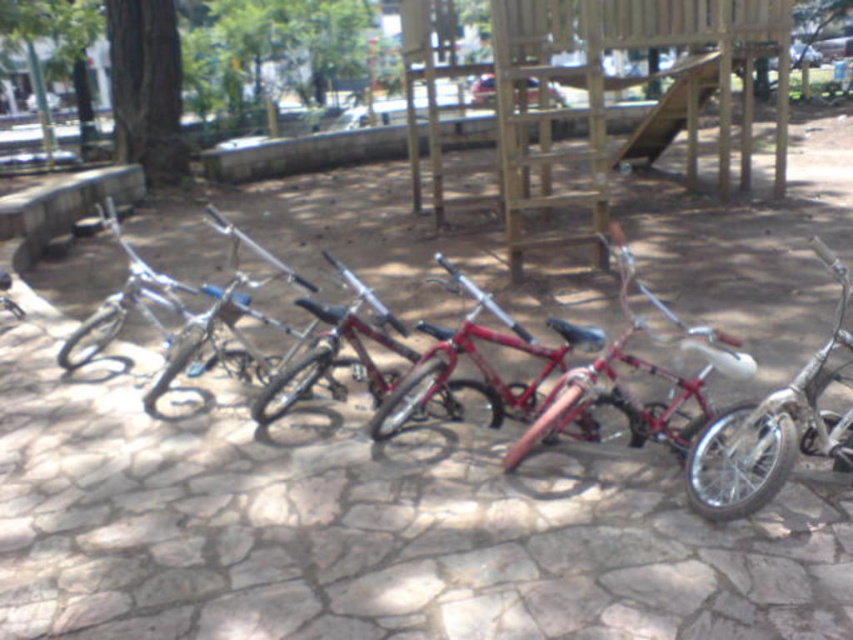
You are a parent trying to find your child a bike. You see two bikes in the middle of the cobblestone area, a shiny silver bicycle at center and a shiny red bicycle at center. Which bike is positioned higher up?

The shiny silver bicycle at center is located above the shiny red bicycle at center, so it is positioned higher up.

You are a parent trying to park your child between the metallic silver bicycle at center and the shiny red bicycle at center. Can you fit your child between them if your child is 8 inches wide?

The metallic silver bicycle at center and the shiny red bicycle at center are 8.01 inches apart. Since your child is 8 inches wide, they can fit between them with a small gap remaining.

You are a parent trying to park your metallic silver bicycle at center and shiny silver bicycle at center in a way that both can be easily accessed. Considering their current positions, which bicycle is blocking the other?

The metallic silver bicycle at center is positioned under the shiny silver bicycle at center, so the shiny silver bicycle at center is blocking the metallic silver bicycle at center.